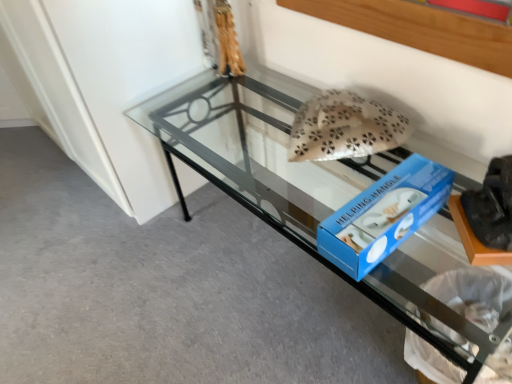
Question: Is beige fabric pillow at center closer to the viewer compared to clear glass table at center?

Choices:
 (A) no
 (B) yes

Answer: (A)

Question: Is beige fabric pillow at center beside clear glass table at center?

Choices:
 (A) yes
 (B) no

Answer: (B)

Question: From a real-world perspective, does beige fabric pillow at center stand above clear glass table at center?

Choices:
 (A) no
 (B) yes

Answer: (B)

Question: From the image's perspective, is beige fabric pillow at center under clear glass table at center?

Choices:
 (A) yes
 (B) no

Answer: (B)

Question: From the image's perspective, is beige fabric pillow at center over clear glass table at center?

Choices:
 (A) no
 (B) yes

Answer: (B)

Question: Is beige fabric pillow at center bigger than clear glass table at center?

Choices:
 (A) no
 (B) yes

Answer: (A)

Question: From the image's perspective, would you say clear glass table at center is positioned over beige fabric pillow at center?

Choices:
 (A) yes
 (B) no

Answer: (B)

Question: Can you confirm if clear glass table at center is taller than beige fabric pillow at center?

Choices:
 (A) yes
 (B) no

Answer: (A)

Question: From a real-world perspective, is clear glass table at center located beneath beige fabric pillow at center?

Choices:
 (A) no
 (B) yes

Answer: (B)

Question: Does clear glass table at center appear on the right side of beige fabric pillow at center?

Choices:
 (A) no
 (B) yes

Answer: (A)

Question: Is beige fabric pillow at center located within clear glass table at center?

Choices:
 (A) no
 (B) yes

Answer: (B)

Question: Does clear glass table at center have a greater width compared to beige fabric pillow at center?

Choices:
 (A) yes
 (B) no

Answer: (A)

Question: From a real-world perspective, is clear glass table at center physically located above or below beige fabric pillow at center?

Choices:
 (A) below
 (B) above

Answer: (A)